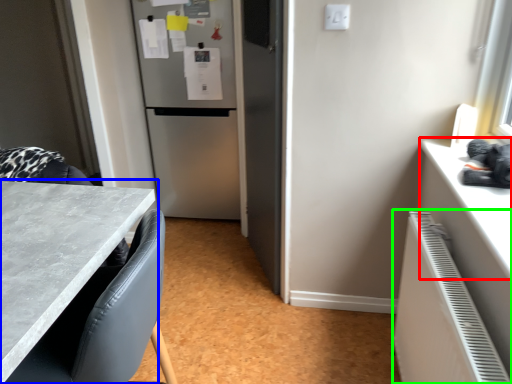
Question: Estimate the real-world distances between objects in this image. Which object is farther from counter top (highlighted by a red box), countertop (highlighted by a blue box) or radiator (highlighted by a green box)?

Choices:
 (A) countertop
 (B) radiator

Answer: (A)